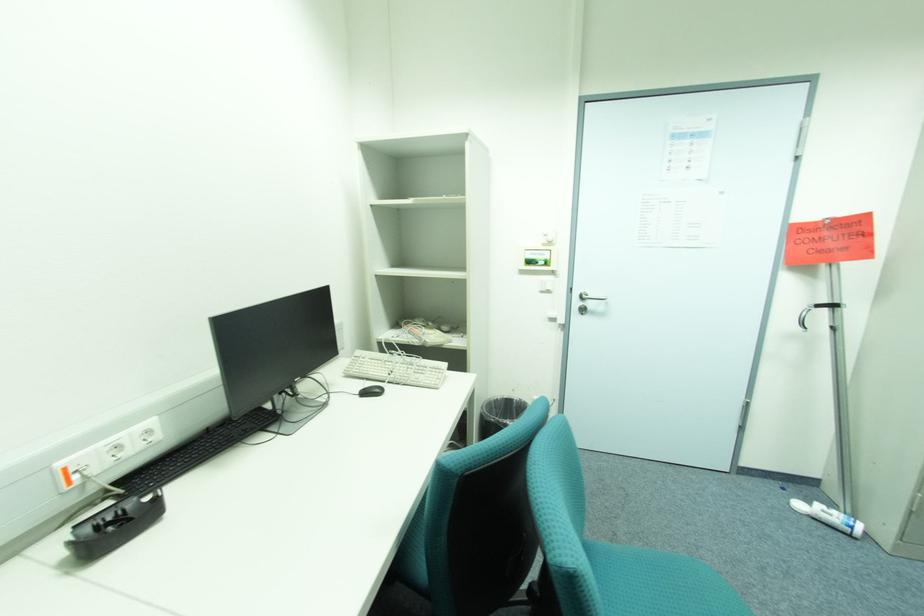
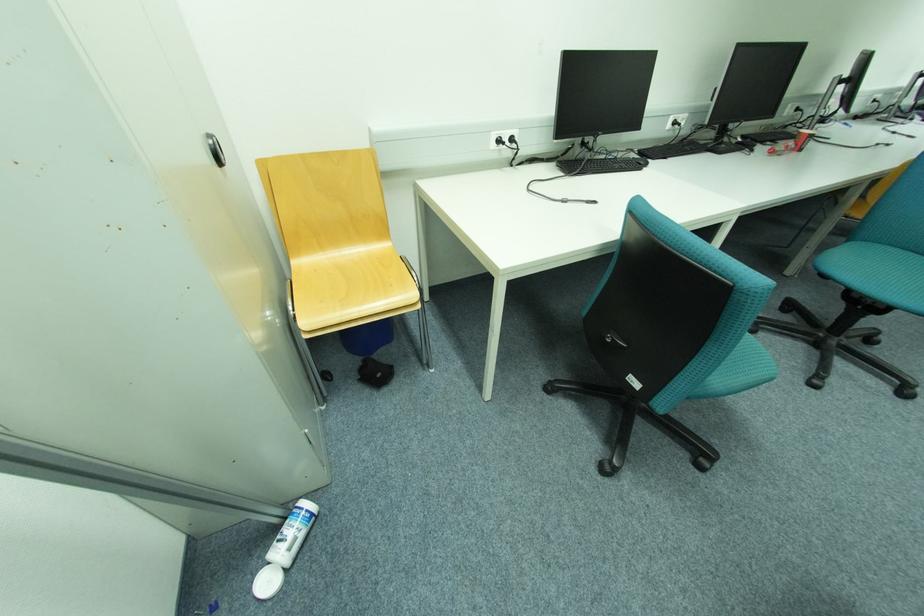
Locate, in the second image, the point that corresponds to pixel 845 511 in the first image.

(287, 525)